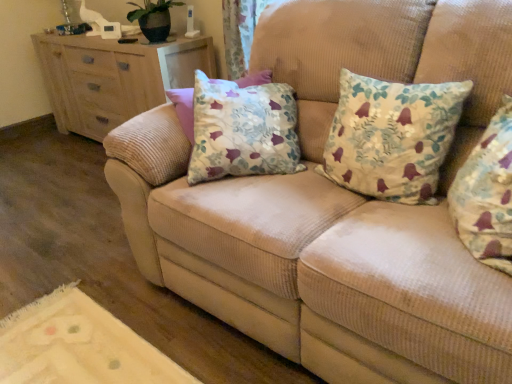
Question: From the image's perspective, relative to floral fabric cushion at center, placed as the second pillow when sorted from back to front, is floral fabric pillow at center, arranged as the first pillow when viewed from the back, above or below?

Choices:
 (A) below
 (B) above

Answer: (B)

Question: In terms of width, does floral fabric pillow at center, the second pillow positioned from the front, look wider or thinner when compared to floral fabric cushion at center, placed as the second pillow when sorted from back to front?

Choices:
 (A) thin
 (B) wide

Answer: (B)

Question: Which object is the closest to the floral fabric cushion at center, which is the 1th pillow from front to back?

Choices:
 (A) wooden chest of drawers at left
 (B) floral fabric pillow at center, arranged as the first pillow when viewed from the back

Answer: (B)

Question: Considering the real-world distances, which object is farthest from the floral fabric pillow at center, arranged as the first pillow when viewed from the back?

Choices:
 (A) floral fabric cushion at center, which is the 1th pillow from front to back
 (B) wooden chest of drawers at left

Answer: (B)